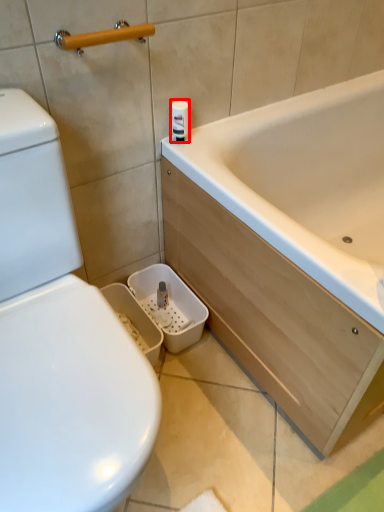
Question: Where is toilet paper (annotated by the red box) located in relation to towel bar in the image?

Choices:
 (A) right
 (B) left

Answer: (A)